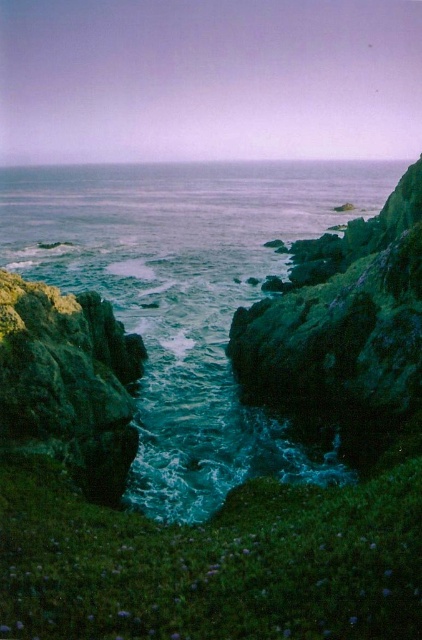
Which is above, teal glossy water at center or green rough rock at center?

Positioned higher is teal glossy water at center.

Between point (173, 333) and point (27, 371), which one is positioned behind?

Point (173, 333)

Between point (140, 209) and point (75, 401), which one is positioned behind?

Positioned behind is point (140, 209).

You are a GUI agent. You are given a task and a screenshot of the screen. Output one action in this format:
    pyautogui.click(x=<x>, y=<y>)
    Task: Click on the teal glossy water at center
    The image size is (422, 640).
    Given the screenshot: What is the action you would take?
    pyautogui.click(x=184, y=296)